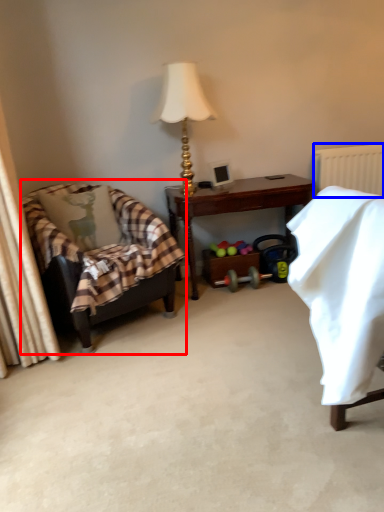
Question: Among these objects, which one is farthest to the camera, chair (highlighted by a red box) or radiator (highlighted by a blue box)?

Choices:
 (A) chair
 (B) radiator

Answer: (B)